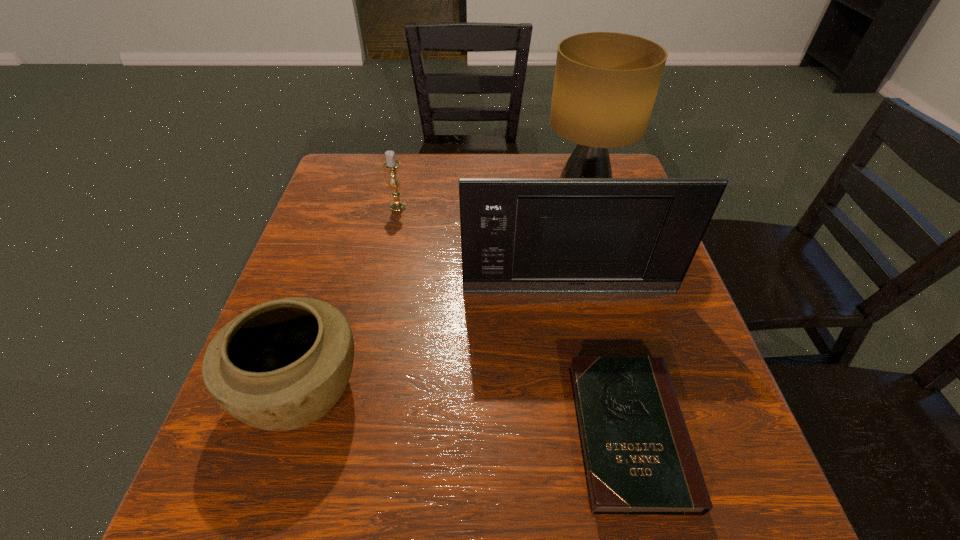
Find the location of a particular element. free point located on the left of the Bible is located at coordinates (547, 433).

You are a GUI agent. You are given a task and a screenshot of the screen. Output one action in this format:
    pyautogui.click(x=<x>, y=<y>)
    Task: Click on the object located in the far edge section of the desktop
    The width and height of the screenshot is (960, 540).
    Given the screenshot: What is the action you would take?
    pyautogui.click(x=605, y=85)

Locate an element on the screen. object at the near edge is located at coordinates (638, 456).

Locate an element on the screen. object that is at the left edge is located at coordinates (281, 365).

You are a GUI agent. You are given a task and a screenshot of the screen. Output one action in this format:
    pyautogui.click(x=<x>, y=<y>)
    Task: Click on the lampshade present at the right edge
    
    Given the screenshot: What is the action you would take?
    pyautogui.click(x=605, y=85)

Where is `microwave oven present at the right edge`? This screenshot has width=960, height=540. microwave oven present at the right edge is located at coordinates (518, 235).

Locate an element on the screen. This screenshot has width=960, height=540. Bible positioned at the right edge is located at coordinates (638, 456).

The image size is (960, 540). I want to click on object located at the far right corner, so click(x=605, y=85).

This screenshot has width=960, height=540. What are the coordinates of `object that is positioned at the near right corner` in the screenshot? It's located at (638, 456).

Where is `blank space at the far edge`? blank space at the far edge is located at coordinates (408, 167).